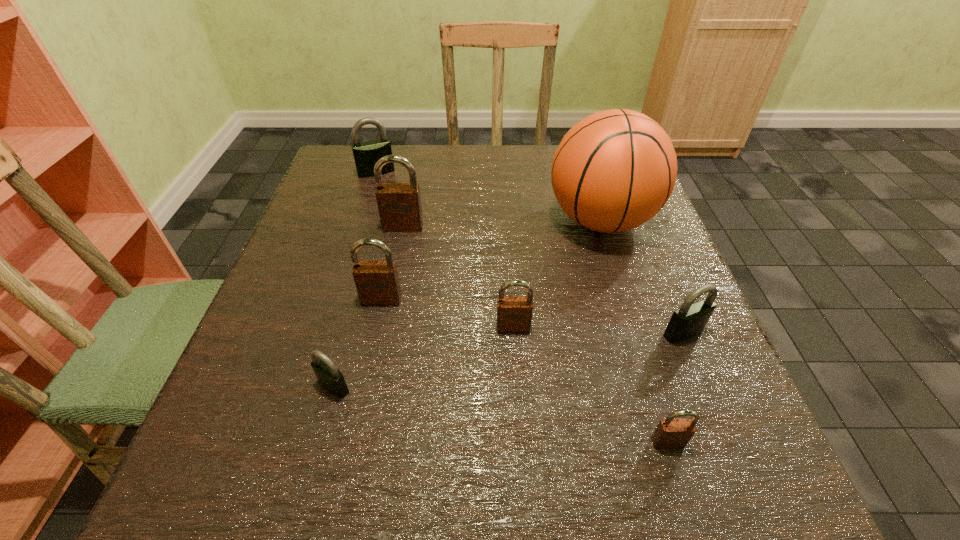
Locate which object ranks fifth in proximity to the farthest brown padlock. Please provide its 2D coordinates. Your answer should be formatted as a tuple, i.e. [(x, y)], where the tuple contains the x and y coordinates of a point satisfying the conditions above.

[(329, 377)]

You are a GUI agent. You are given a task and a screenshot of the screen. Output one action in this format:
    pyautogui.click(x=<x>, y=<y>)
    Task: Click on the padlock that is the closest to the biggest black padlock
    
    Given the screenshot: What is the action you would take?
    pyautogui.click(x=399, y=204)

Locate which padlock is the fourth closest to the rightmost brown padlock. Please provide its 2D coordinates. Your answer should be formatted as a tuple, i.e. [(x, y)], where the tuple contains the x and y coordinates of a point satisfying the conditions above.

[(377, 282)]

Where is `brown padlock that is the second closest to the smallest black padlock`? brown padlock that is the second closest to the smallest black padlock is located at coordinates (514, 313).

Identify which brown padlock is the nearest to the rightmost padlock. Please provide its 2D coordinates. Your answer should be formatted as a tuple, i.e. [(x, y)], where the tuple contains the x and y coordinates of a point satisfying the conditions above.

[(670, 433)]

Where is `black padlock that is the second closest to the second nearest brown padlock`? This screenshot has width=960, height=540. black padlock that is the second closest to the second nearest brown padlock is located at coordinates (329, 377).

Where is `black padlock identified as the second closest to the rightmost padlock`? Image resolution: width=960 pixels, height=540 pixels. black padlock identified as the second closest to the rightmost padlock is located at coordinates (366, 154).

Find the location of a particular element. free spot that satisfies the following two spatial constraints: 1. on the front-facing side of the third farthest padlock; 2. on the right side of the second nearest black padlock is located at coordinates [x=374, y=333].